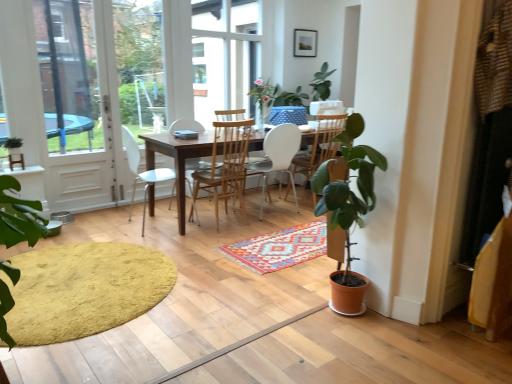
Question: From the image's perspective, is wooden table at center positioned above or below matte black picture frame at upper center?

Choices:
 (A) above
 (B) below

Answer: (B)

Question: Is wooden table at center wider or thinner than matte black picture frame at upper center?

Choices:
 (A) thin
 (B) wide

Answer: (B)

Question: Which object is the farthest from the wooden table at center?

Choices:
 (A) white plastic chair at center, which is the 3th chair from right to left
 (B) multicolored woven rug at center, the 1th doormat viewed from the right
 (C) green matte plant at left
 (D) white plastic chair at center, positioned as the first chair in right-to-left order
 (E) yellow soft rug at lower left, which ranks as the first doormat in left-to-right order

Answer: (C)

Question: Which of these objects is positioned farthest from the matte black picture frame at upper center?

Choices:
 (A) wooden table at center
 (B) yellow soft rug at lower left, which ranks as the first doormat in left-to-right order
 (C) white glass door at left
 (D) white plastic chair at center, the 3th chair from the left
 (E) green matte plant at left

Answer: (B)